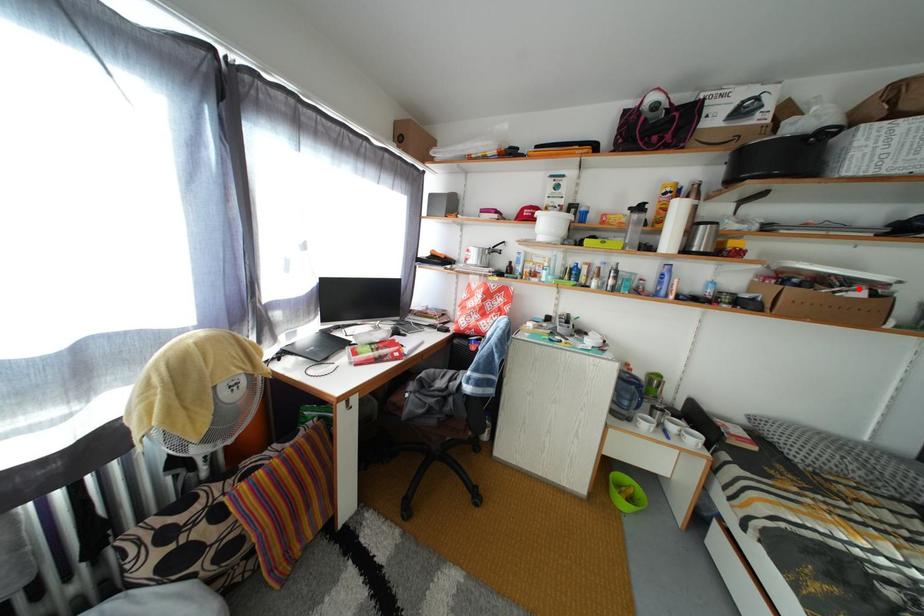
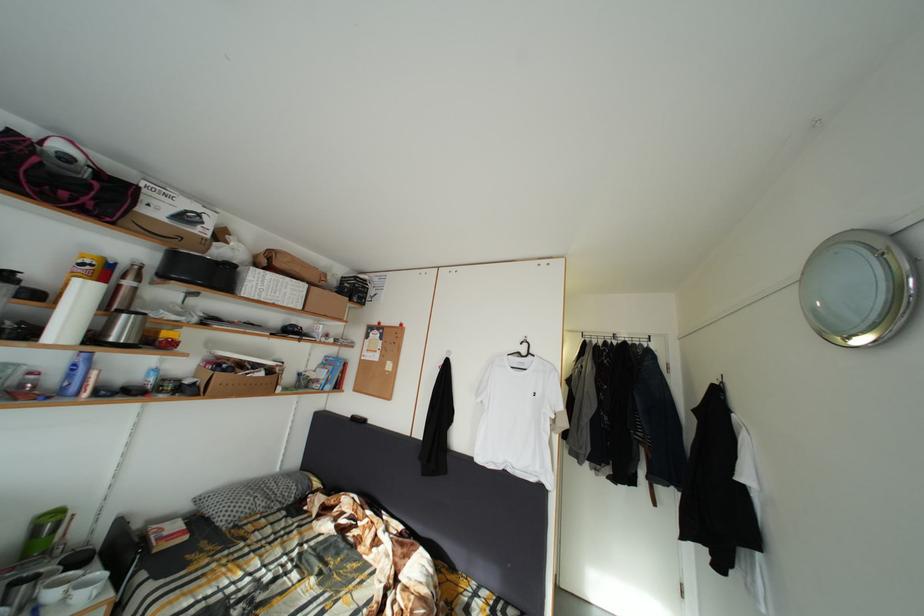
Question: I am providing you with two images of the same scene from different viewpoints. A red point is marked on the first image. At the location where the point appears in image 1, is it still visible in image 2?

Choices:
 (A) Yes
 (B) No

Answer: (A)